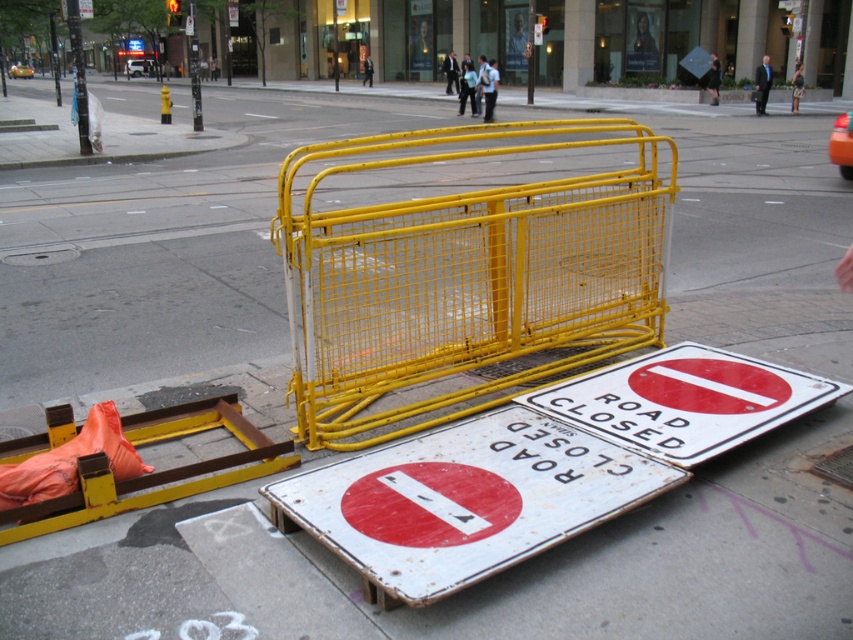
Does rusty metal road closed sign at center have a greater height compared to orange fabric barricade at lower left?

Yes, rusty metal road closed sign at center is taller than orange fabric barricade at lower left.

Does rusty metal road closed sign at center come behind orange fabric barricade at lower left?

No, it is not.

Where is `rusty metal road closed sign at center`? rusty metal road closed sign at center is located at coordinates (463, 500).

Can you confirm if yellow metal fence at center is positioned below rusty metal road closed sign at center?

Incorrect, yellow metal fence at center is not positioned below rusty metal road closed sign at center.

What do you see at coordinates (466, 275) in the screenshot? The image size is (853, 640). I see `yellow metal fence at center` at bounding box center [466, 275].

Who is more forward, (372, 161) or (538, 525)?

Point (538, 525) is more forward.

The image size is (853, 640). Find the location of `yellow metal fence at center`. yellow metal fence at center is located at coordinates (466, 275).

Can you confirm if yellow metal fence at center is positioned to the left of orange fabric barricade at lower left?

No, yellow metal fence at center is not to the left of orange fabric barricade at lower left.

Between point (445, 401) and point (0, 524), which one is positioned behind?

The point (445, 401) is more distant.

Locate an element on the screen. The height and width of the screenshot is (640, 853). yellow metal fence at center is located at coordinates (466, 275).